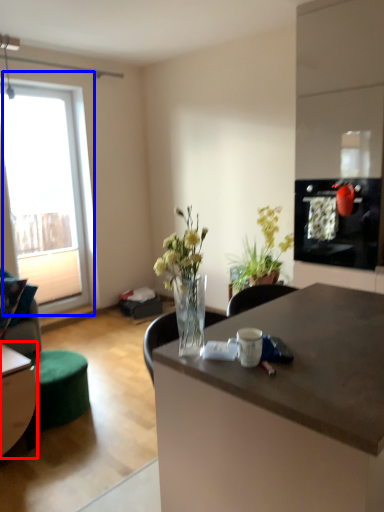
Question: Among these objects, which one is nearest to the camera, table (highlighted by a red box) or window (highlighted by a blue box)?

Choices:
 (A) table
 (B) window

Answer: (A)